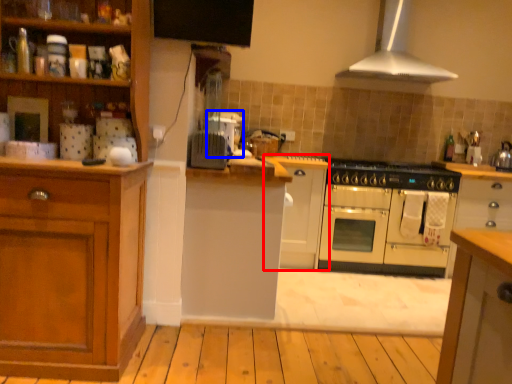
Question: Which object appears closest to the camera in this image, cabinetry (highlighted by a red box) or appliance (highlighted by a blue box)?

Choices:
 (A) cabinetry
 (B) appliance

Answer: (B)